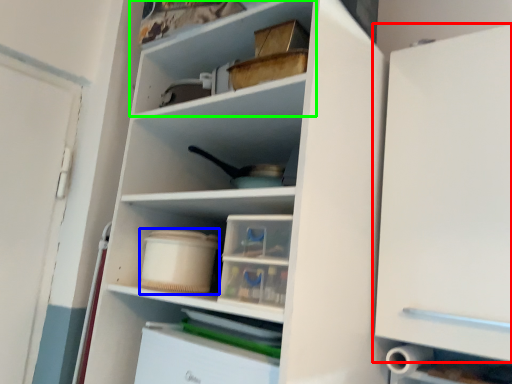
Question: Estimate the real-world distances between objects in this image. Which object is farther from cabinetry (highlighted by a red box), storage box (highlighted by a blue box) or shelf (highlighted by a green box)?

Choices:
 (A) storage box
 (B) shelf

Answer: (A)